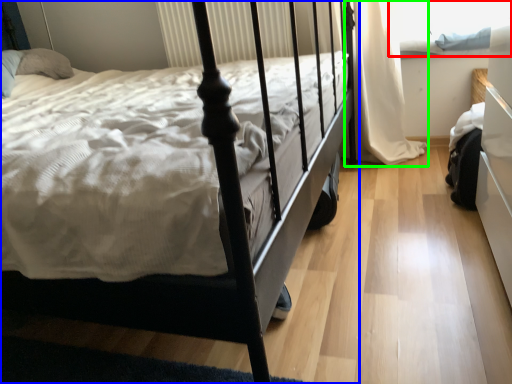
Question: Which is nearer to the window screen (highlighted by a red box)? bed (highlighted by a blue box) or curtain (highlighted by a green box).

Choices:
 (A) bed
 (B) curtain

Answer: (B)